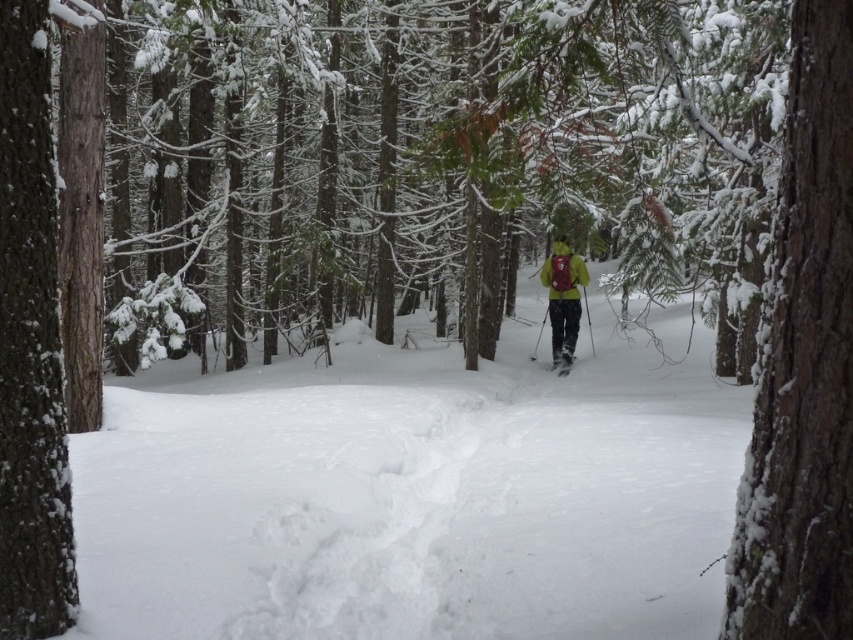
You are standing at the edge of the forest and see the point marked at coordinates (412,497). Based on the scene description, what is the most likely object or surface located at that point?

The point at coordinates (412,497) corresponds to white fluffy snow at center, as described in the scene.

You are an observer in the winter forest scene. You notice the white fluffy snow at center and the matte green jacket at center. Which object is taller?

The matte green jacket at center is taller than the white fluffy snow at center.